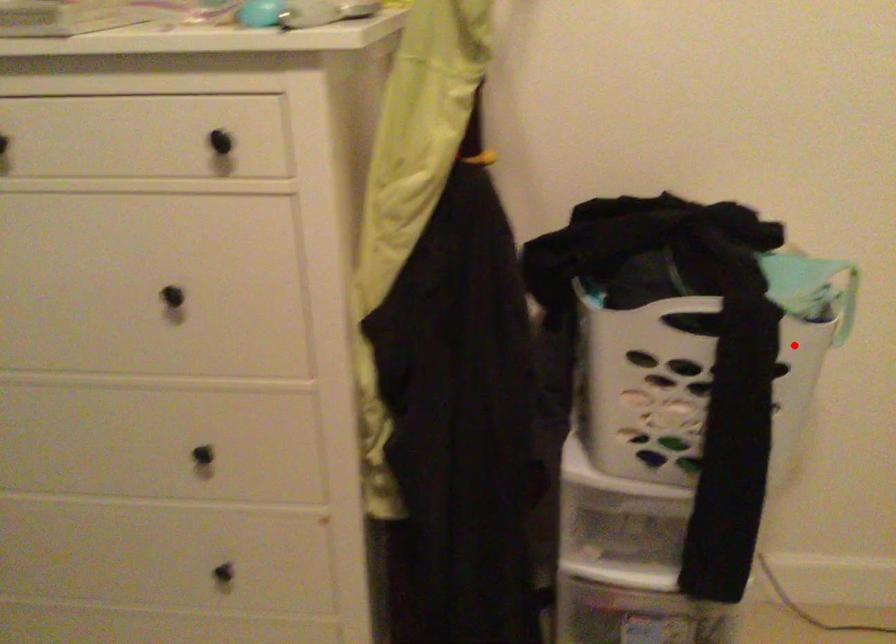
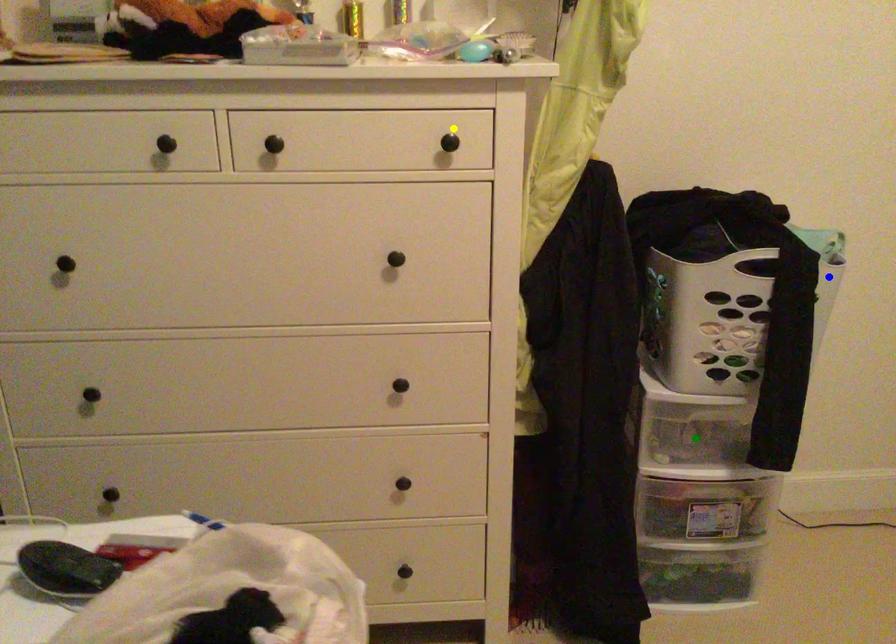
Question: I am providing you with two images of the same scene from different viewpoints. A red point is marked on the first image. You are given multiple points on the second image. Which point in image 2 is actually the same real-world point as the red point in image 1?

Choices:
 (A) yellow point
 (B) blue point
 (C) green point

Answer: (B)